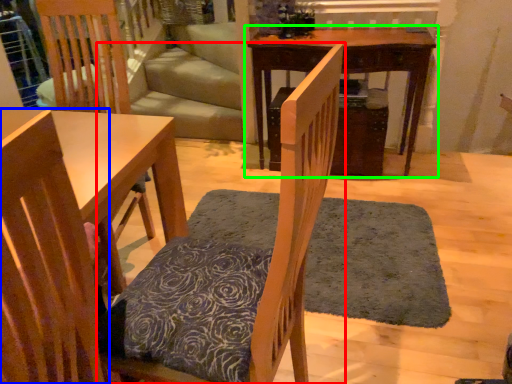
Question: Estimate the real-world distances between objects in this image. Which object is farther from chair (highlighted by a red box), chair (highlighted by a blue box) or table (highlighted by a green box)?

Choices:
 (A) chair
 (B) table

Answer: (B)